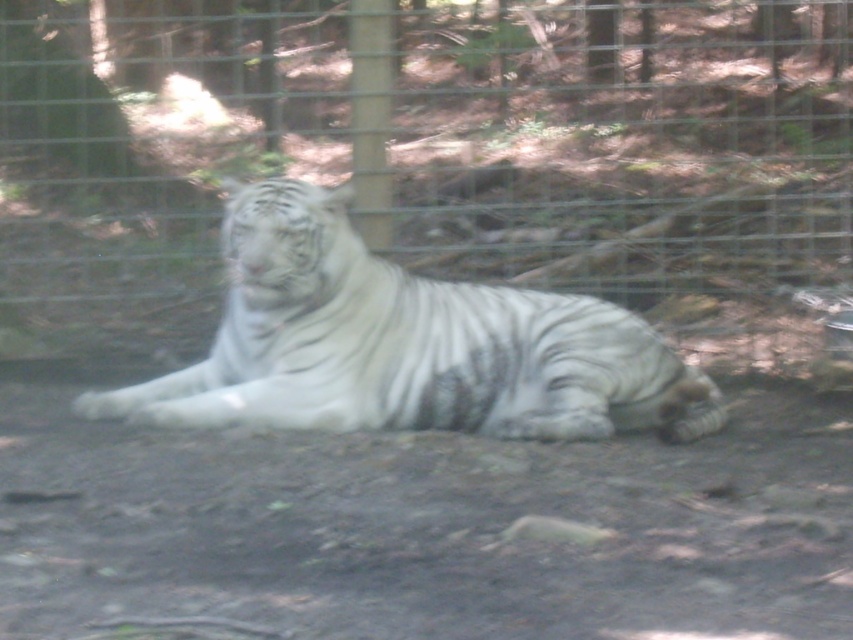
Between metal wire fence at center and white striped tiger at center, which one is positioned higher?

metal wire fence at center is higher up.

Is metal wire fence at center shorter than white striped tiger at center?

In fact, metal wire fence at center may be taller than white striped tiger at center.

The width and height of the screenshot is (853, 640). What do you see at coordinates (428, 141) in the screenshot?
I see `metal wire fence at center` at bounding box center [428, 141].

Locate an element on the screen. This screenshot has height=640, width=853. metal wire fence at center is located at coordinates (428, 141).